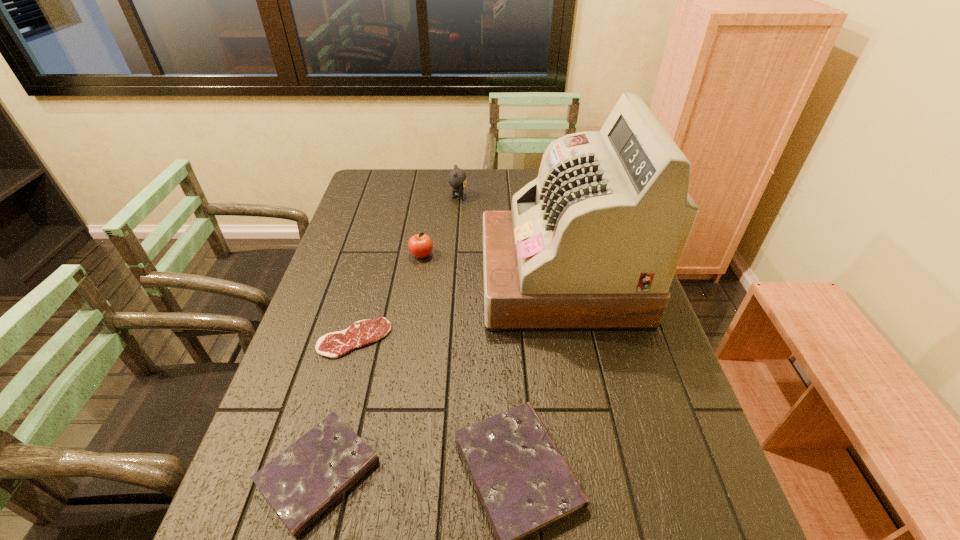
Where is `vacant space located 0.170m on the back of the shortest object`? vacant space located 0.170m on the back of the shortest object is located at coordinates [372, 276].

Where is `object situated at the far edge`? The width and height of the screenshot is (960, 540). object situated at the far edge is located at coordinates (457, 178).

Find the location of a particular element. This screenshot has height=540, width=960. object that is at the left edge is located at coordinates (333, 345).

I want to click on object present at the right edge, so click(593, 243).

In the image, there is a desktop. Where is `free space at the far edge`? free space at the far edge is located at coordinates [x=425, y=181].

This screenshot has height=540, width=960. I want to click on vacant region at the left edge of the desktop, so pyautogui.click(x=388, y=215).

Image resolution: width=960 pixels, height=540 pixels. In the image, there is a desktop. In order to click on vacant space at the right edge in this screenshot , I will do `click(643, 343)`.

You are a GUI agent. You are given a task and a screenshot of the screen. Output one action in this format:
    pyautogui.click(x=<x>, y=<y>)
    Task: Click on the vacant point located between the kitten and the steak
    The image size is (960, 540).
    Given the screenshot: What is the action you would take?
    pyautogui.click(x=406, y=268)

Where is `vacant area between the kitten and the fourth shortest object`? vacant area between the kitten and the fourth shortest object is located at coordinates (440, 226).

Identify the location of vacant space that is in between the fifth shortest object and the third tallest object. (440, 226).